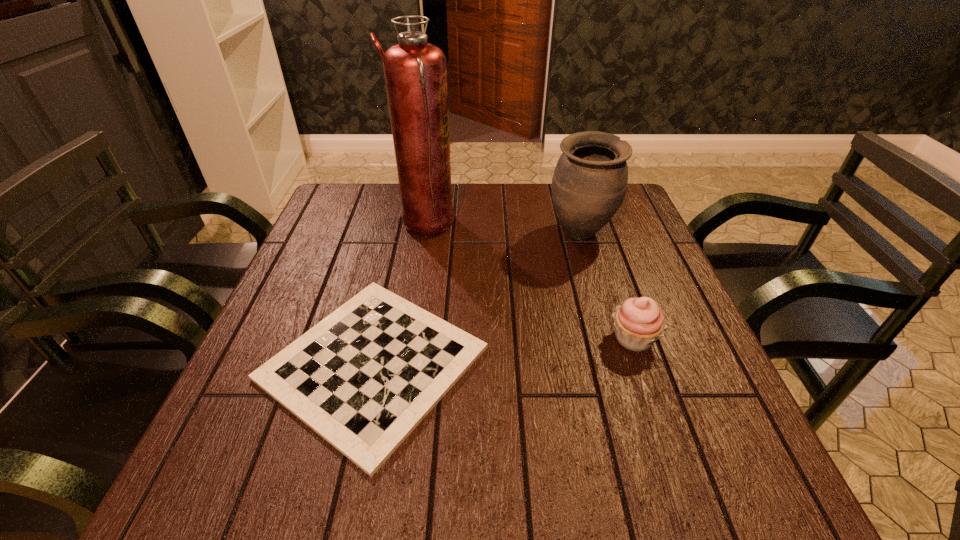
Find the location of a particular element. The height and width of the screenshot is (540, 960). object present at the near edge is located at coordinates (363, 378).

This screenshot has height=540, width=960. In order to click on object that is at the left edge in this screenshot , I will do `click(363, 378)`.

The image size is (960, 540). I want to click on urn that is at the right edge, so click(x=589, y=183).

Identify the location of cupcake present at the right edge. This screenshot has width=960, height=540. (639, 322).

The width and height of the screenshot is (960, 540). I want to click on object that is at the near left corner, so click(363, 378).

Find the location of a particular element. The width and height of the screenshot is (960, 540). object that is at the far right corner is located at coordinates (589, 183).

This screenshot has width=960, height=540. What are the coordinates of `vacant point at the far edge` in the screenshot? It's located at (476, 186).

Find the location of a particular element. The width and height of the screenshot is (960, 540). vacant space at the near edge of the desktop is located at coordinates (520, 482).

The image size is (960, 540). In the image, there is a desktop. Identify the location of free region at the left edge. [363, 239].

In the image, there is a desktop. Identify the location of vacant space at the right edge. The height and width of the screenshot is (540, 960). (610, 239).